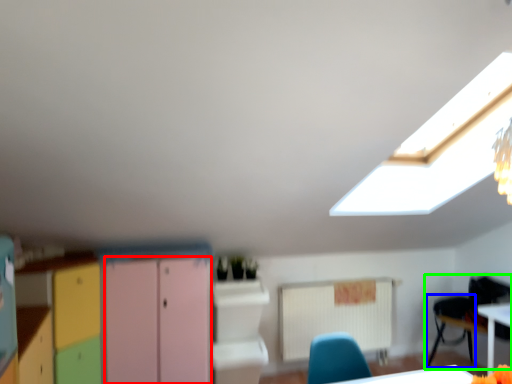
Question: Considering the real-world distances, which object is closest to file cabinet (highlighted by a red box)? armchair (highlighted by a blue box) or chair (highlighted by a green box).

Choices:
 (A) armchair
 (B) chair

Answer: (B)